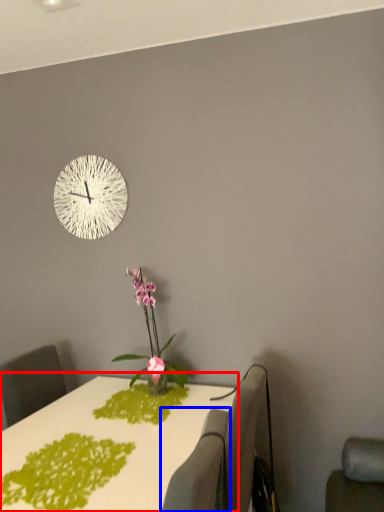
Question: Among these objects, which one is farthest to the camera, table (highlighted by a red box) or swivel chair (highlighted by a blue box)?

Choices:
 (A) table
 (B) swivel chair

Answer: (A)